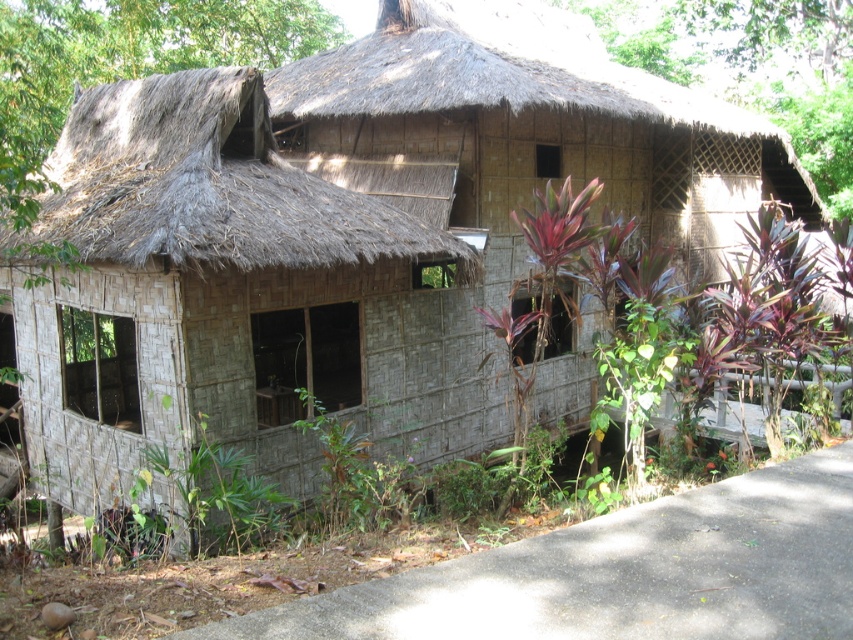
Can you confirm if thatched straw roof at upper left is taller than thatched straw roof at upper center?

In fact, thatched straw roof at upper left may be shorter than thatched straw roof at upper center.

Can you confirm if thatched straw roof at upper left is thinner than thatched straw roof at upper center?

Yes, thatched straw roof at upper left is thinner than thatched straw roof at upper center.

Which is behind, point (120, 204) or point (410, 97)?

Positioned behind is point (410, 97).

Where is `thatched straw roof at upper left`? thatched straw roof at upper left is located at coordinates (210, 186).